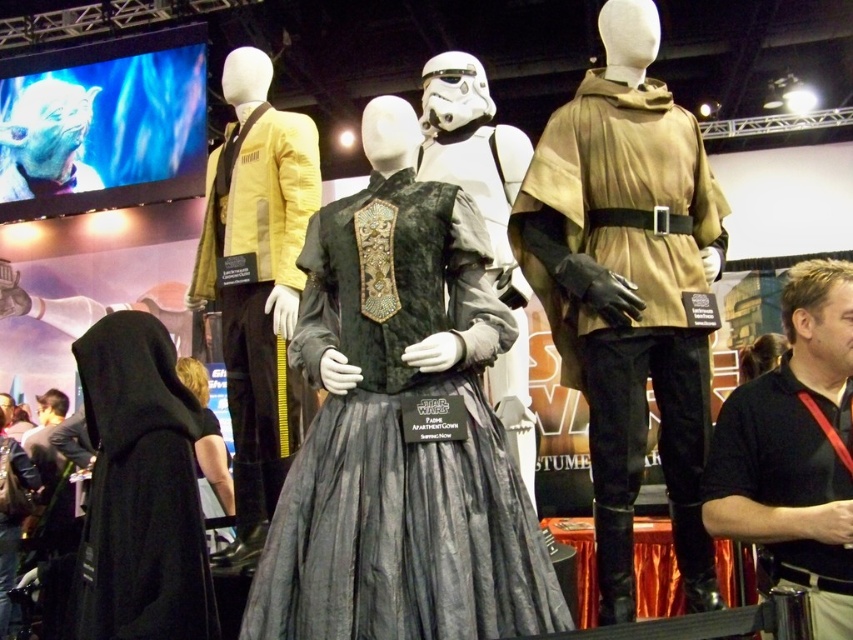
Question: Does matte brown cape at center have a greater width compared to black cotton polo shirt at center right?

Choices:
 (A) yes
 (B) no

Answer: (A)

Question: Considering the real-world distances, which object is closest to the matte yellow jacket at center?

Choices:
 (A) velvet black dress at center
 (B) black velvet dress at lower left

Answer: (A)

Question: Can you confirm if black matte robe at lower left is positioned to the left of dark gray fabric robe at lower left?

Choices:
 (A) yes
 (B) no

Answer: (B)

Question: Which of the following is the closest to the observer?

Choices:
 (A) pyautogui.click(x=142, y=413)
 (B) pyautogui.click(x=247, y=195)
 (C) pyautogui.click(x=616, y=257)
 (D) pyautogui.click(x=450, y=540)

Answer: (D)

Question: Among these objects, which one is nearest to the camera?

Choices:
 (A) black cotton polo shirt at center right
 (B) matte yellow jacket at center
 (C) velvet black dress at center

Answer: (A)

Question: Is matte yellow jacket at center to the right of dark gray fabric robe at lower left from the viewer's perspective?

Choices:
 (A) yes
 (B) no

Answer: (A)